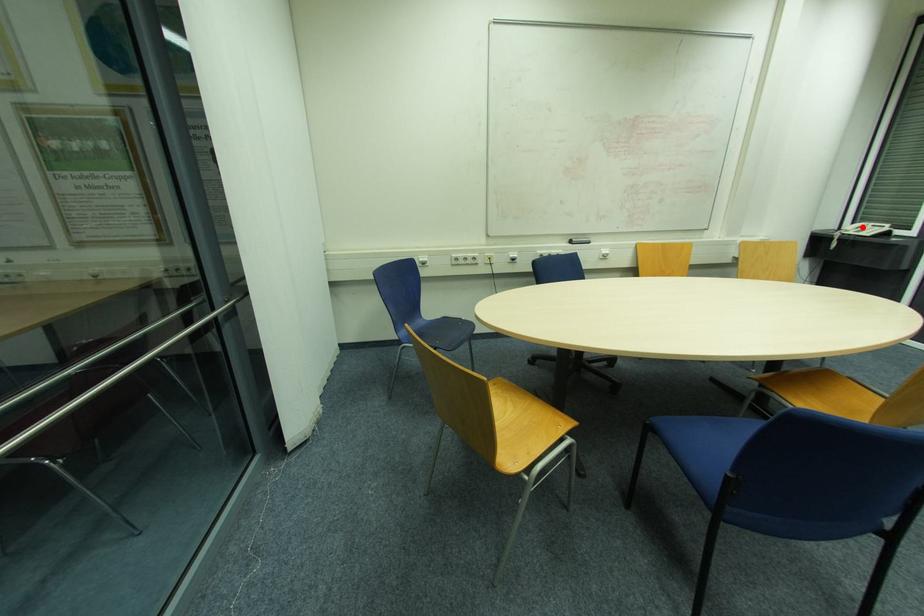
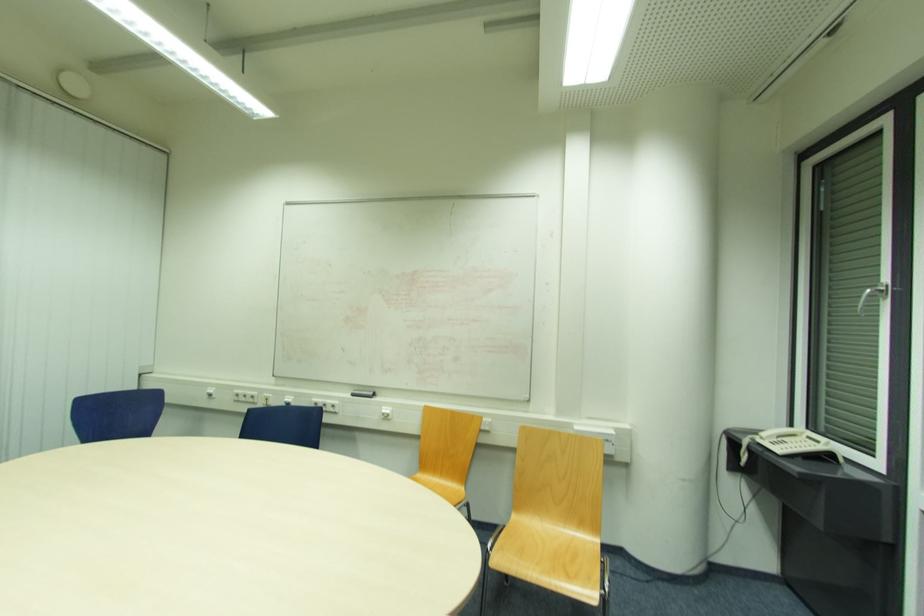
Locate, in the second image, the point that corresponds to the highlighted location in the first image.

(793, 436)